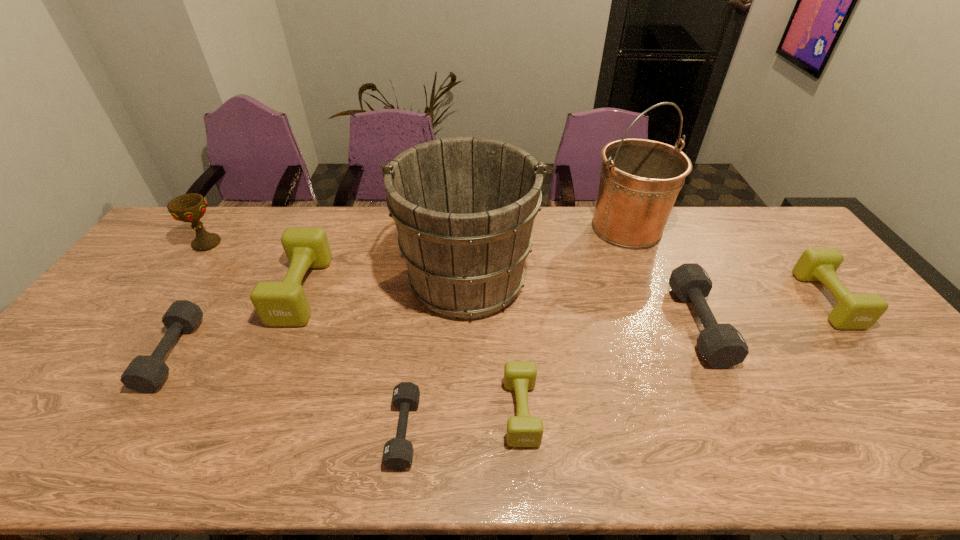
You are a GUI agent. You are given a task and a screenshot of the screen. Output one action in this format:
    pyautogui.click(x=<x>, y=<y>)
    Task: Click on the vacant space that's between the second olive dumbbell from right to left and the second dumbbell from right to left
    The height and width of the screenshot is (540, 960).
    Given the screenshot: What is the action you would take?
    pyautogui.click(x=610, y=368)

I want to click on free space between the left bucket and the second biggest olive dumbbell, so click(647, 288).

Identify which object is located as the seventh nearest to the biggest olive dumbbell. Please provide its 2D coordinates. Your answer should be formatted as a tuple, i.e. [(x, y)], where the tuple contains the x and y coordinates of a point satisfying the conditions above.

[(721, 345)]

The image size is (960, 540). Identify the location of the third closest object to the second smallest olive dumbbell. (464, 208).

The image size is (960, 540). Identify the location of dumbbell that is the closest to the rightmost gray dumbbell. (853, 311).

Identify which dumbbell is located as the third nearest to the fourth dumbbell from right to left. Please provide its 2D coordinates. Your answer should be formatted as a tuple, i.e. [(x, y)], where the tuple contains the x and y coordinates of a point satisfying the conditions above.

[(145, 373)]

Where is `olive dumbbell that stands as the closest to the seventh shortest object`? olive dumbbell that stands as the closest to the seventh shortest object is located at coordinates (278, 304).

Select which olive dumbbell appears as the second closest to the eighth object from right to left. Please provide its 2D coordinates. Your answer should be formatted as a tuple, i.e. [(x, y)], where the tuple contains the x and y coordinates of a point satisfying the conditions above.

[(523, 430)]

Select which gray dumbbell is the third closest to the seventh shortest object. Please provide its 2D coordinates. Your answer should be formatted as a tuple, i.e. [(x, y)], where the tuple contains the x and y coordinates of a point satisfying the conditions above.

[(721, 345)]

Locate which gray dumbbell ranks in proximity to the shortest dumbbell. Please provide its 2D coordinates. Your answer should be formatted as a tuple, i.e. [(x, y)], where the tuple contains the x and y coordinates of a point satisfying the conditions above.

[(145, 373)]